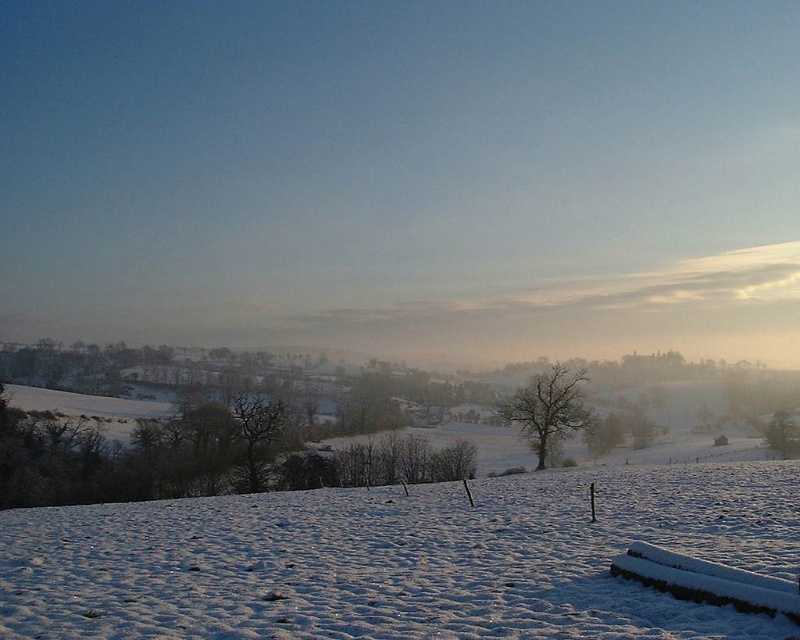
Question: Where is white fluffy snow at center located in relation to dark brown textured tree at center in the image?

Choices:
 (A) right
 (B) left

Answer: (A)

Question: Which point is closer to the camera?

Choices:
 (A) (8, 515)
 (B) (584, 419)

Answer: (A)

Question: Among these objects, which one is nearest to the camera?

Choices:
 (A) dark brown textured tree at center
 (B) white fluffy snow at center

Answer: (B)

Question: Does bare tree at center appear under dark brown textured tree at center?

Choices:
 (A) no
 (B) yes

Answer: (A)

Question: Can you confirm if white fluffy snow at center is positioned to the left of bare tree at center?

Choices:
 (A) yes
 (B) no

Answer: (A)

Question: Which of the following is the farthest from the observer?

Choices:
 (A) (762, 515)
 (B) (248, 440)
 (C) (517, 401)

Answer: (C)